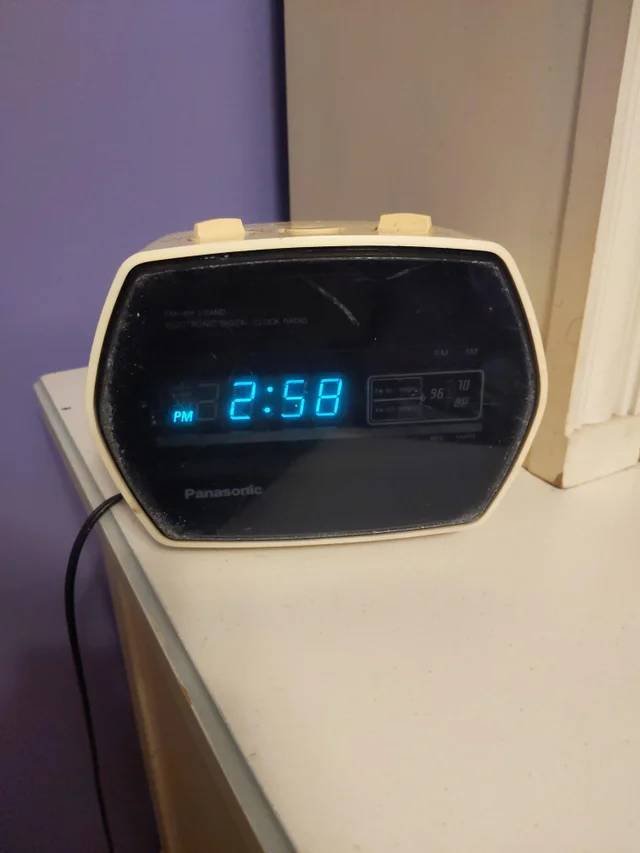
The image size is (640, 853). I want to click on wall, so tap(192, 184).